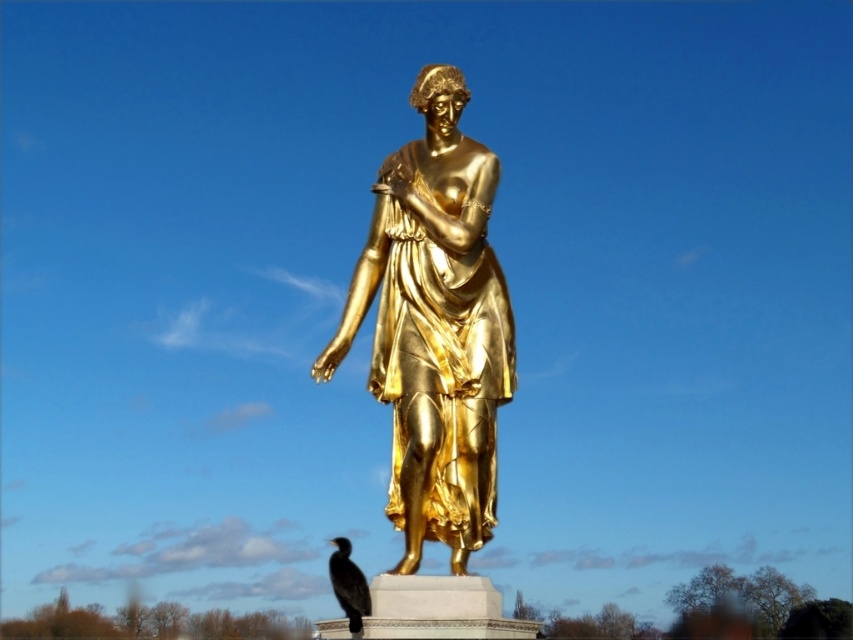
Question: Is gold polished statue at center above black feathered bird at lower center?

Choices:
 (A) no
 (B) yes

Answer: (B)

Question: Is gold polished statue at center positioned before black feathered bird at lower center?

Choices:
 (A) no
 (B) yes

Answer: (A)

Question: Which object appears closest to the camera in this image?

Choices:
 (A) black feathered bird at lower center
 (B) gold polished statue at center

Answer: (A)

Question: Considering the relative positions of gold polished statue at center and black feathered bird at lower center in the image provided, where is gold polished statue at center located with respect to black feathered bird at lower center?

Choices:
 (A) left
 (B) right

Answer: (B)